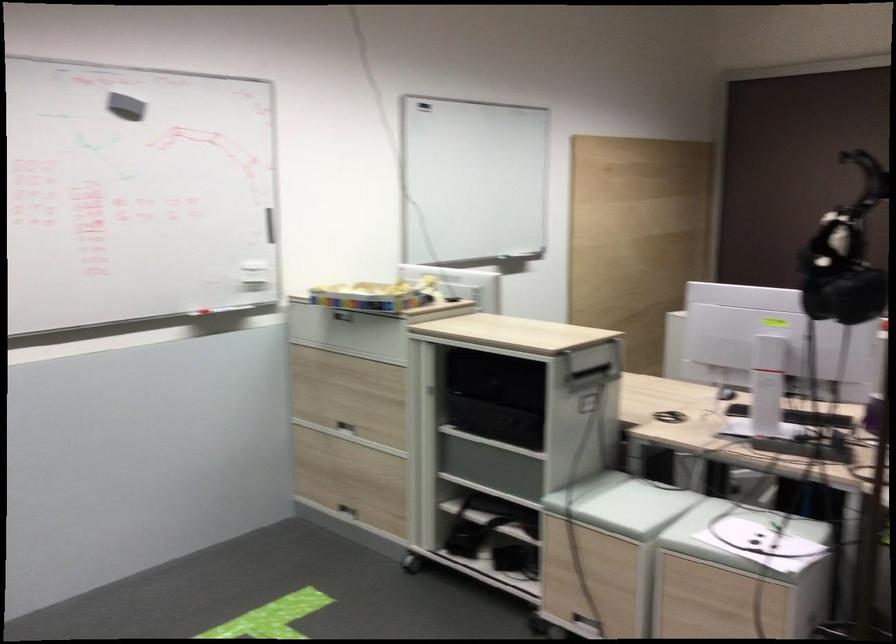
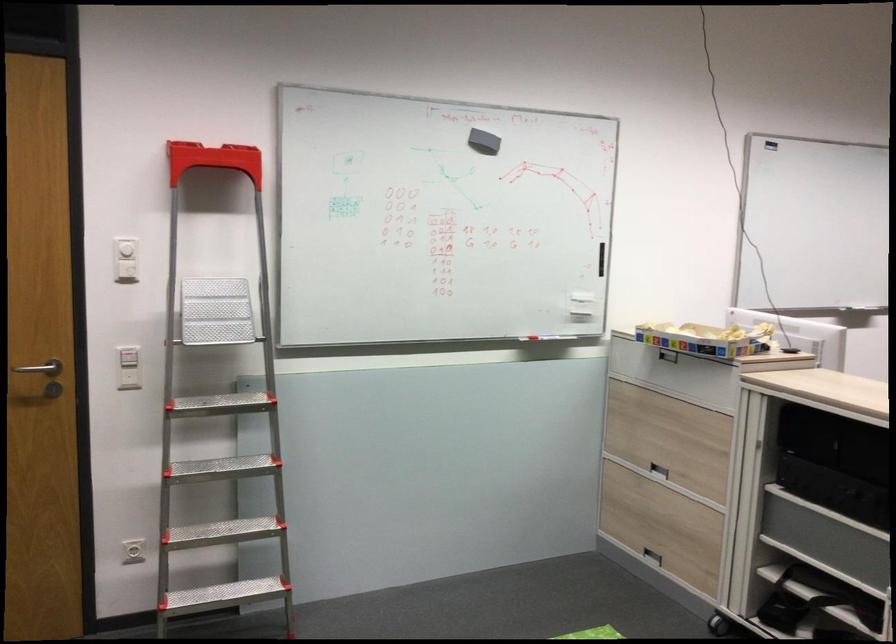
In the second image, find the point that corresponds to (345,427) in the first image.

(658, 469)